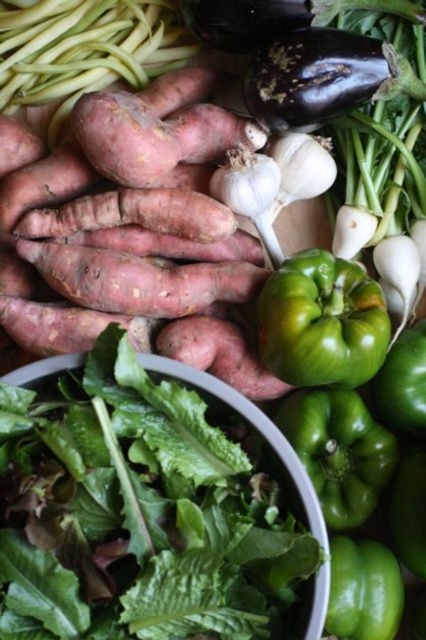
Consider the image. You are a customer at the vegetable stand and want to pick up the bell peppers. Which point should you look at first, point (34, 180) or point (336, 304)?

You should look at point (34, 180) first because it is closer to you than point (336, 304).

You are a chef preparing a vegetable platter and need to know which vegetable has a greater width. Looking at the rustic brown sweet potato at center and the green matte bell pepper at center, which one is wider?

The rustic brown sweet potato at center is wider than the green matte bell pepper at center according to the description.

You are standing 3 feet away from the vegetables. Is the point at coordinates point (218, 336) within your reach?

The point (218, 336) is 3.36 feet away from the viewer. Since you are standing 3 feet away, it is 0.36 feet further, so you cannot reach it.